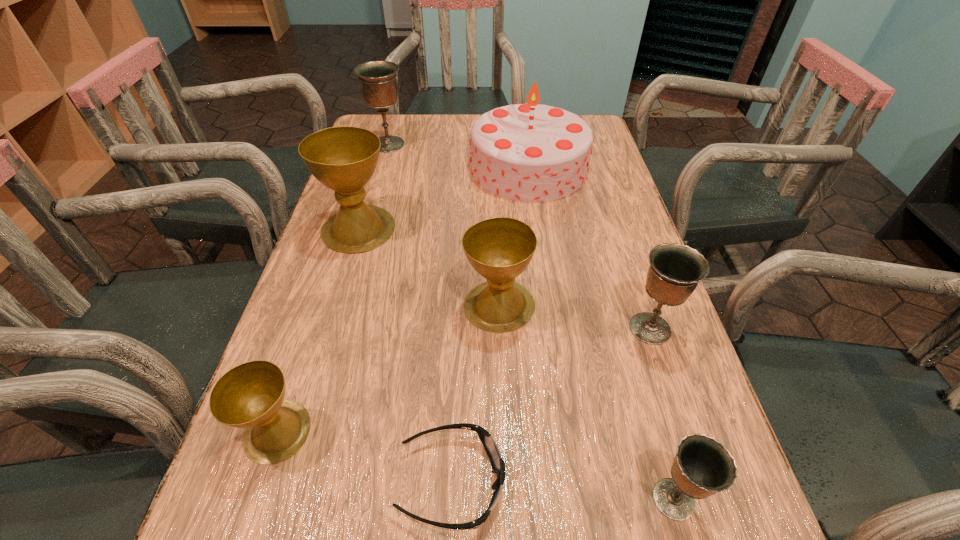
You are a GUI agent. You are given a task and a screenshot of the screen. Output one action in this format:
    pyautogui.click(x=<x>, y=<y>)
    Task: Click on the free location that satisfies the following two spatial constraints: 1. on the front side of the second smallest bronze chalice; 2. on the right side of the birthday cake
    Image resolution: width=960 pixels, height=540 pixels.
    Given the screenshot: What is the action you would take?
    pyautogui.click(x=551, y=328)

Locate an element on the screen. The width and height of the screenshot is (960, 540). free space that satisfies the following two spatial constraints: 1. on the front side of the rightmost brown chalice; 2. on the right side of the farthest bronze chalice is located at coordinates (343, 305).